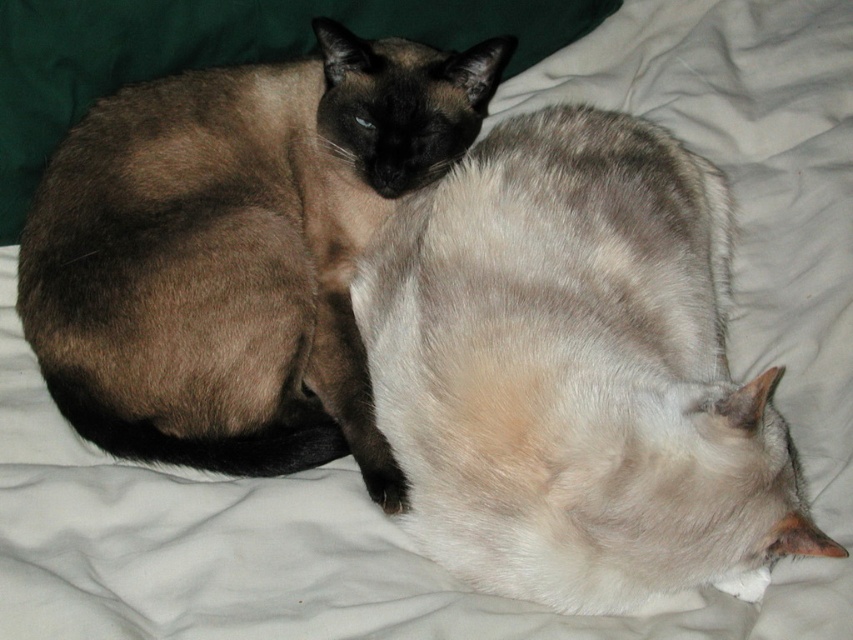
Who is positioned more to the left, silky white cat at center or brown fur cat at upper left?

Positioned to the left is brown fur cat at upper left.

Between silky white cat at center and brown fur cat at upper left, which one is positioned lower?

silky white cat at center is lower down.

Is point (567, 490) farther from viewer compared to point (308, 397)?

No, (567, 490) is closer to viewer.

At what (x,y) coordinates should I click in order to perform the action: click on silky white cat at center. Please return your answer as a coordinate pair (x, y). The width and height of the screenshot is (853, 640). Looking at the image, I should click on (575, 371).